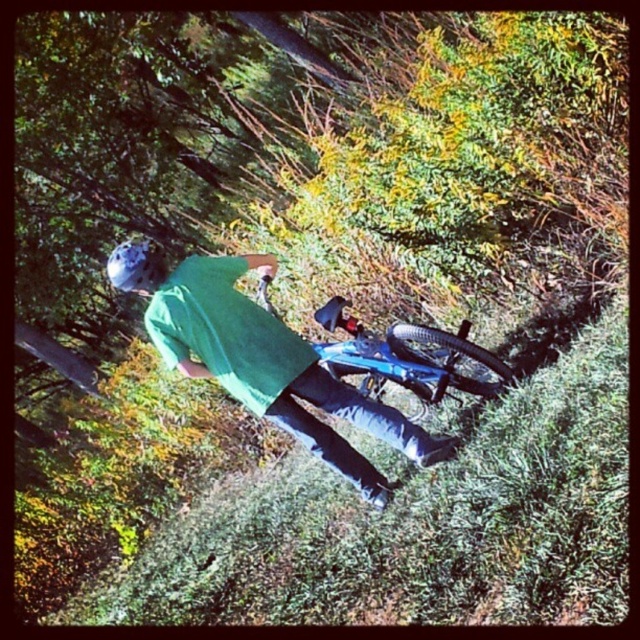
Which is more to the right, blue matte mountain bike at center or matte blue helmet at upper left?

blue matte mountain bike at center is more to the right.

Is blue matte mountain bike at center positioned in front of matte blue helmet at upper left?

No, blue matte mountain bike at center is behind matte blue helmet at upper left.

Image resolution: width=640 pixels, height=640 pixels. What are the coordinates of `blue matte mountain bike at center` in the screenshot? It's located at (410, 358).